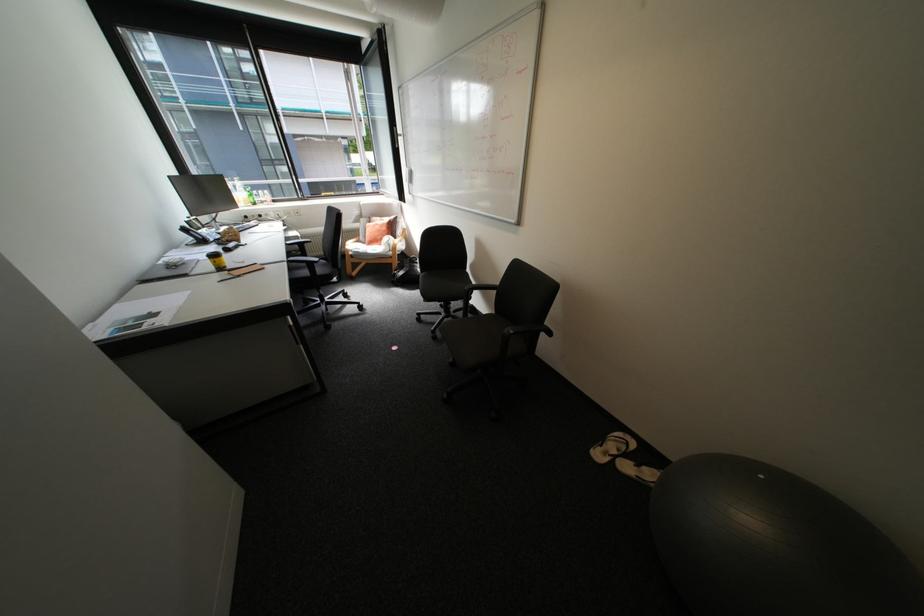
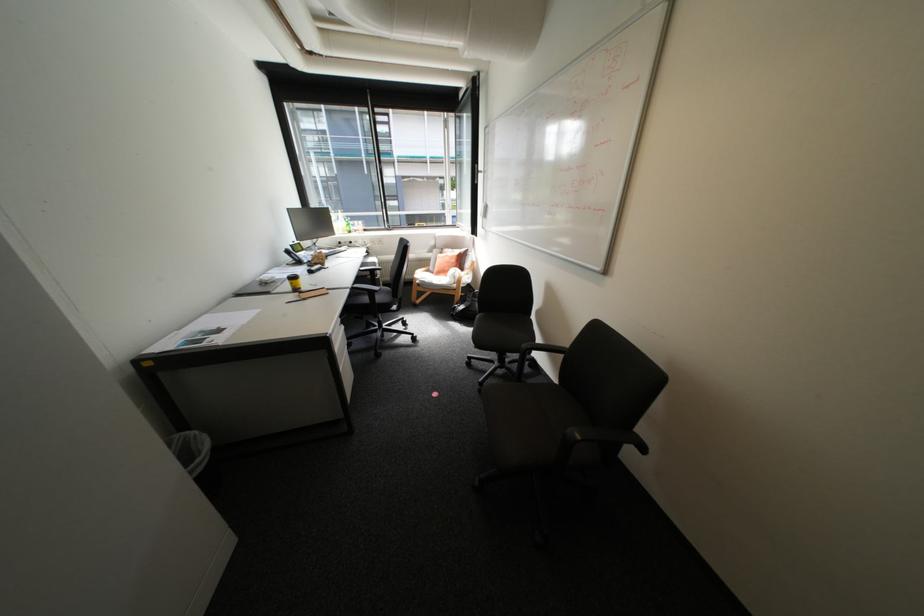
Question: How did the camera likely rotate?

Choices:
 (A) Left
 (B) Right
 (C) Up
 (D) Down

Answer: (A)